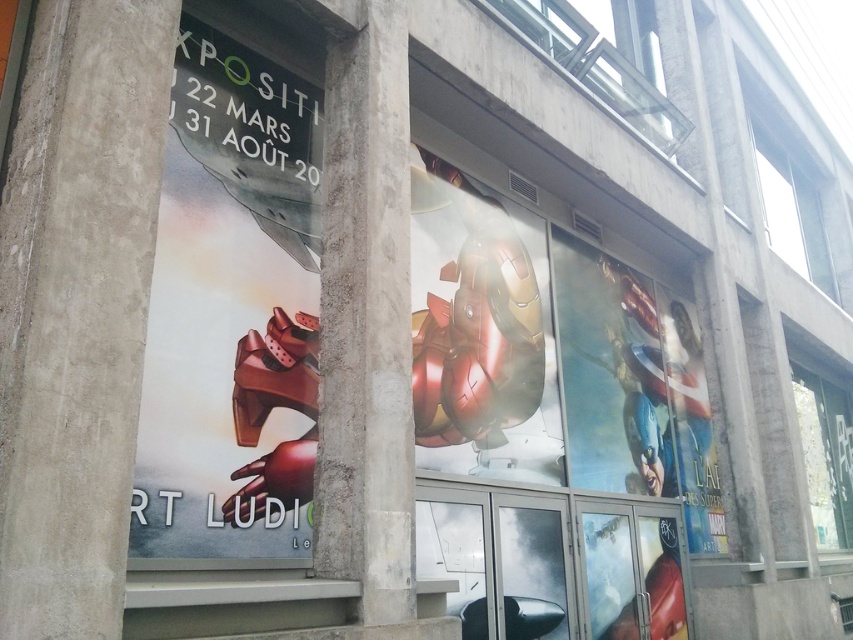
Question: Is concrete pillar at center closer to camera compared to shiny metallic iron man suit at center?

Choices:
 (A) no
 (B) yes

Answer: (B)

Question: Which point is closer to the camera taking this photo?

Choices:
 (A) (561, 248)
 (B) (373, 513)

Answer: (B)

Question: Can you confirm if concrete pillar at center is positioned above shiny metallic iron man suit at center?

Choices:
 (A) no
 (B) yes

Answer: (B)

Question: Which point is closer to the camera?

Choices:
 (A) concrete pillar at center
 (B) shiny metallic iron man suit at center

Answer: (A)

Question: Is concrete pillar at center bigger than shiny metallic iron man suit at center?

Choices:
 (A) no
 (B) yes

Answer: (A)